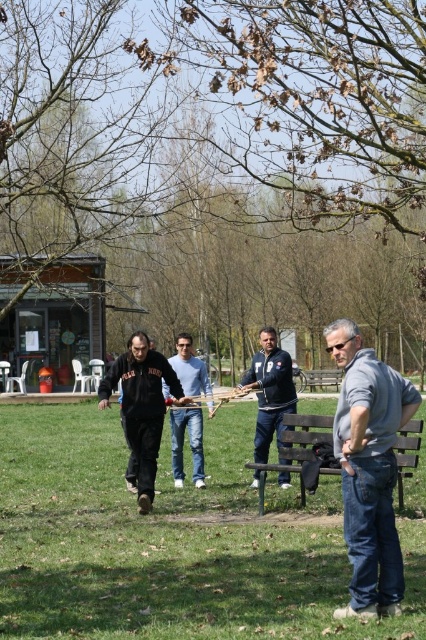
Who is higher up, brown wooden bench at center or denim jeans at center?

brown wooden bench at center is above.

Is brown wooden bench at center to the left of denim jeans at center from the viewer's perspective?

In fact, brown wooden bench at center is to the right of denim jeans at center.

The image size is (426, 640). Identify the location of brown wooden bench at center. (296, 449).

What are the coordinates of `brown wooden bench at center` in the screenshot? It's located at (296, 449).

Does black fleece at center appear under blue denim jacket at center?

Yes.

Between point (127, 428) and point (261, 333), which one is positioned behind?

The point (261, 333) is more distant.

Is point (158, 410) less distant than point (270, 365)?

Yes, point (158, 410) is closer to viewer.

At what (x,y) coordinates should I click in order to perform the action: click on black fleece at center. Please return your answer as a coordinate pair (x, y). Image resolution: width=426 pixels, height=640 pixels. Looking at the image, I should click on (141, 408).

What do you see at coordinates (296, 449) in the screenshot?
I see `brown wooden bench at center` at bounding box center [296, 449].

Can you confirm if brown wooden bench at center is smaller than wooden bench at center?

Incorrect, brown wooden bench at center is not smaller in size than wooden bench at center.

The image size is (426, 640). Identify the location of brown wooden bench at center. click(296, 449).